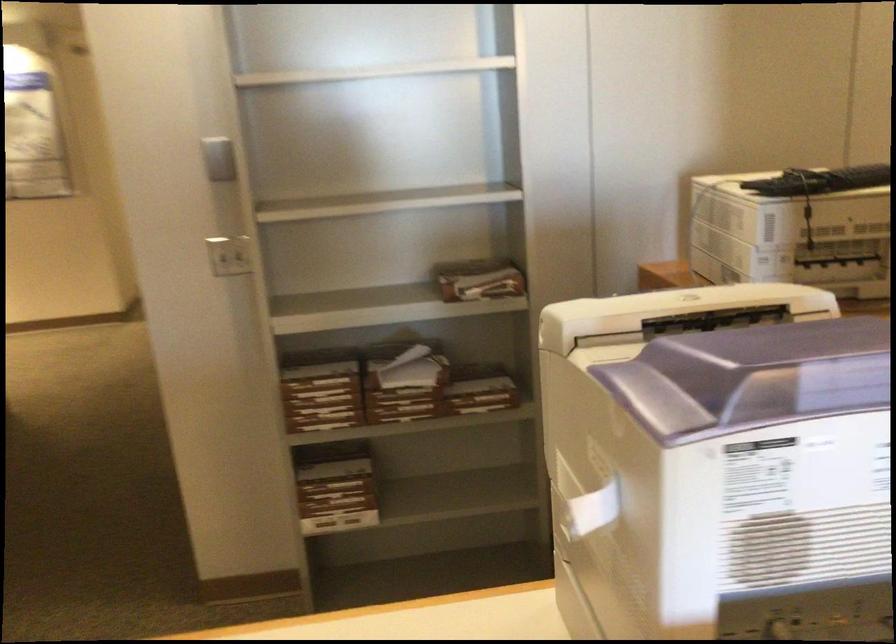
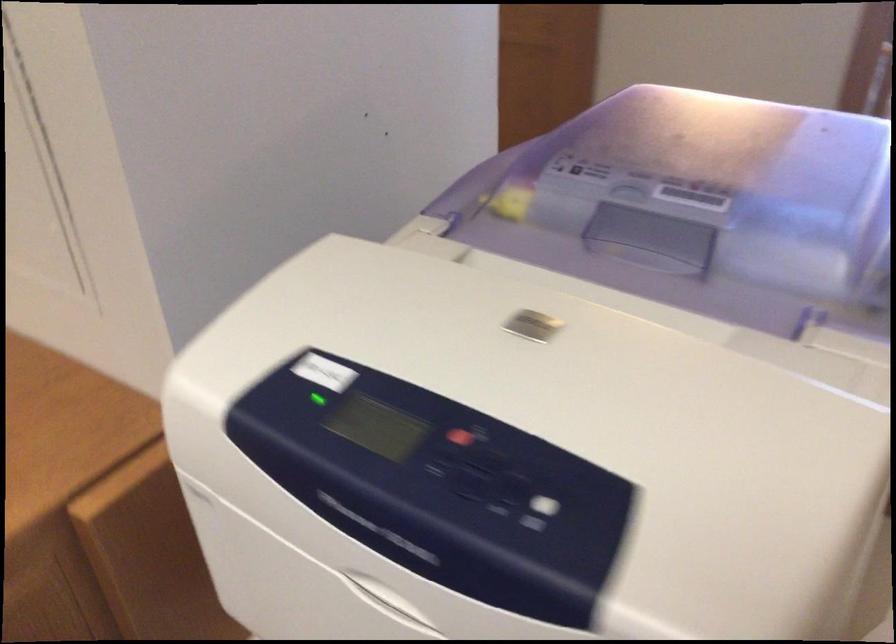
Where in the second image is the point corresponding to (794,375) from the first image?

(656, 234)